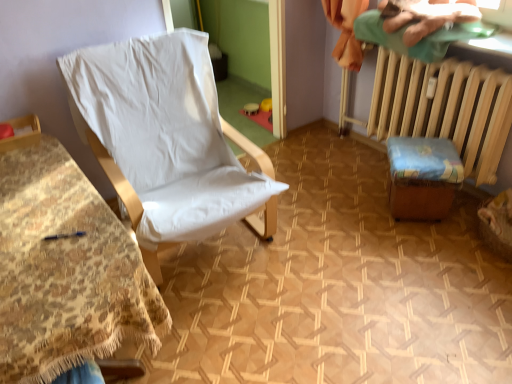
Find the location of a particular element. vacant space to the right of white fabric chair at center is located at coordinates (347, 249).